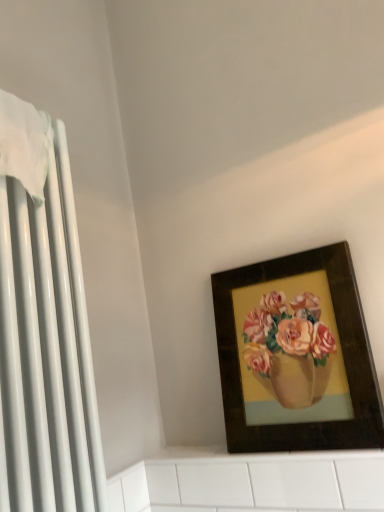
Question: Is white glossy radiator at left bigger or smaller than wooden picture frame at upper right?

Choices:
 (A) big
 (B) small

Answer: (A)

Question: From a real-world perspective, is white glossy radiator at left positioned above or below wooden picture frame at upper right?

Choices:
 (A) above
 (B) below

Answer: (A)

Question: From their relative heights in the image, would you say white glossy radiator at left is taller or shorter than wooden picture frame at upper right?

Choices:
 (A) tall
 (B) short

Answer: (A)

Question: Is wooden picture frame at upper right spatially inside white glossy radiator at left, or outside of it?

Choices:
 (A) outside
 (B) inside

Answer: (A)

Question: Based on their positions, is wooden picture frame at upper right located to the left or right of white glossy radiator at left?

Choices:
 (A) right
 (B) left

Answer: (A)

Question: Considering their positions, is wooden picture frame at upper right located in front of or behind white glossy radiator at left?

Choices:
 (A) front
 (B) behind

Answer: (B)

Question: Looking at their shapes, would you say wooden picture frame at upper right is wider or thinner than white glossy radiator at left?

Choices:
 (A) thin
 (B) wide

Answer: (A)